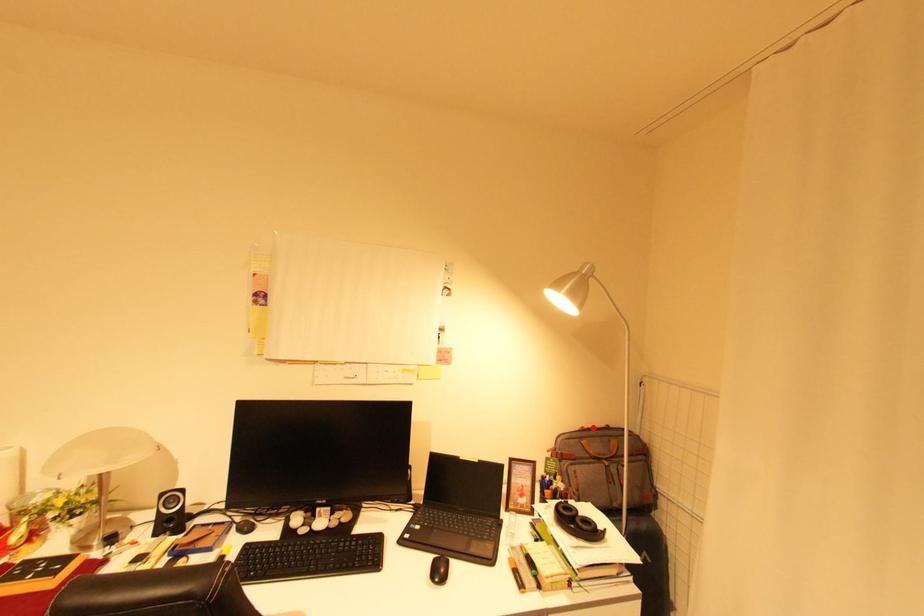
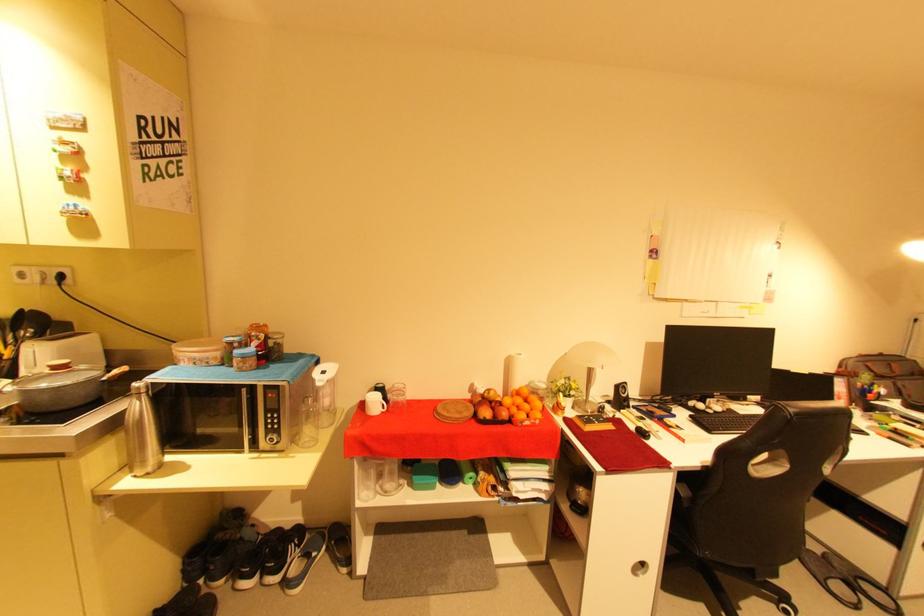
Find the pixel in the second image that matches the highlighted location in the first image.

(871, 354)